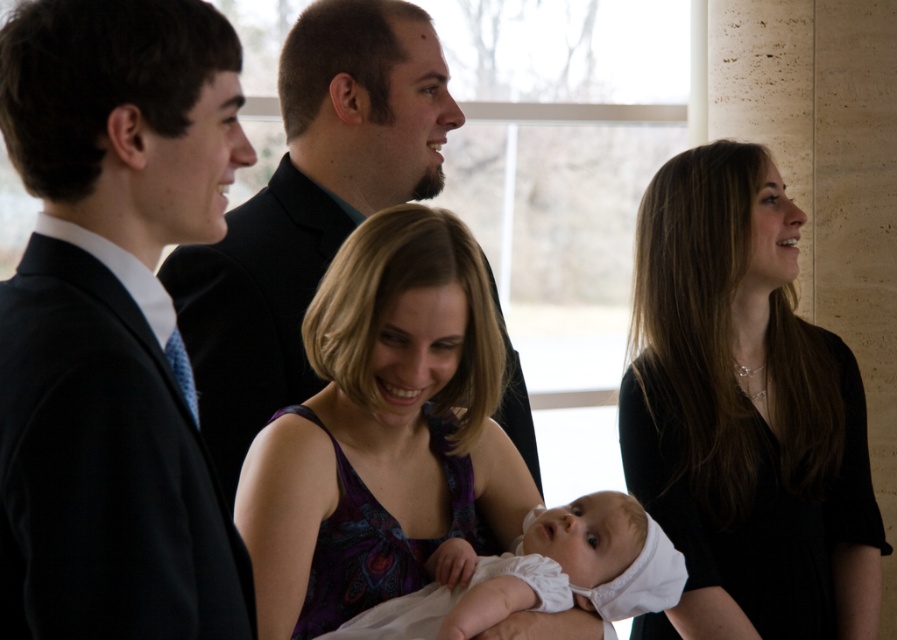
Is black matte dress at center above purple satin dress at center?

Yes.

Is black matte dress at center smaller than purple satin dress at center?

No, black matte dress at center is not smaller than purple satin dress at center.

Is point (663, 316) farther from camera compared to point (414, 364)?

Yes.

Find the location of a particular element. black matte dress at center is located at coordinates (745, 413).

Does point (107, 620) lie in front of point (214, 310)?

Yes, it is.

Does matte black suit at left lie behind matte black suit at center?

No.

The width and height of the screenshot is (897, 640). What are the coordinates of `matte black suit at left` in the screenshot? It's located at (112, 323).

Can you confirm if purple satin dress at center is wider than white soft fabric baby at center?

In fact, purple satin dress at center might be narrower than white soft fabric baby at center.

Does purple satin dress at center appear under white soft fabric baby at center?

Incorrect, purple satin dress at center is not positioned below white soft fabric baby at center.

Is point (471, 378) positioned after point (651, 608)?

Yes, it is.

The height and width of the screenshot is (640, 897). What are the coordinates of `purple satin dress at center` in the screenshot? It's located at [381, 429].